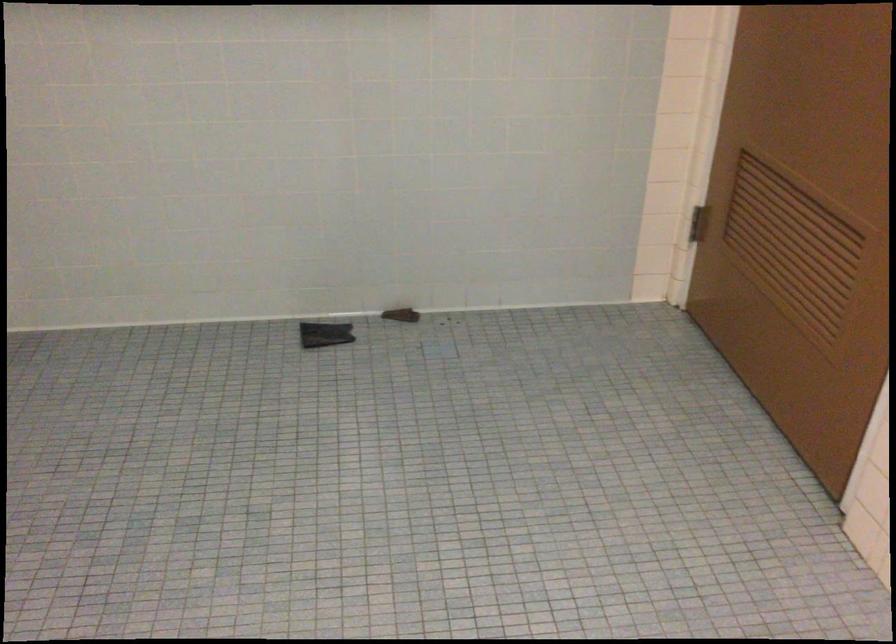
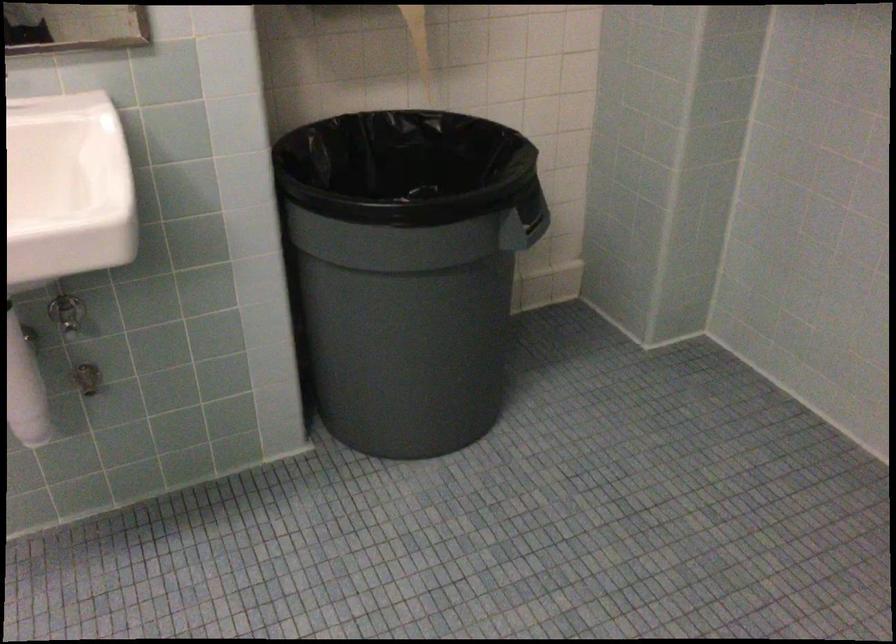
The images are taken continuously from a first-person perspective. In which direction is your viewpoint rotating?

The rotation direction of the camera is left-down.